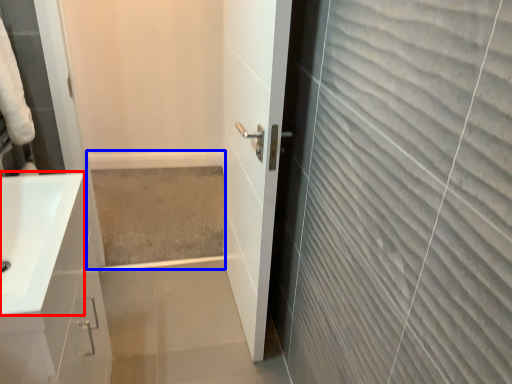
Question: Among these objects, which one is nearest to the camera, sink (highlighted by a red box) or bath (highlighted by a blue box)?

Choices:
 (A) sink
 (B) bath

Answer: (A)